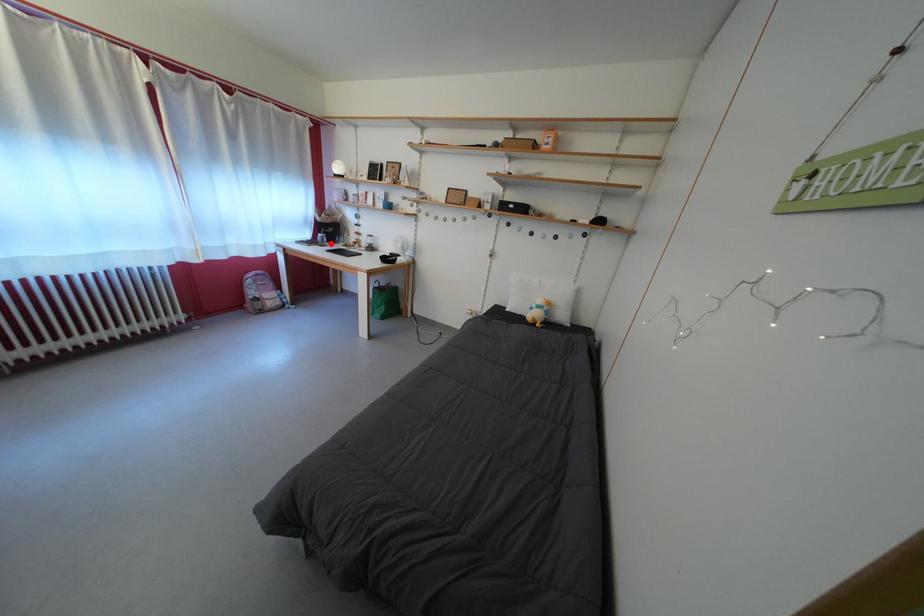
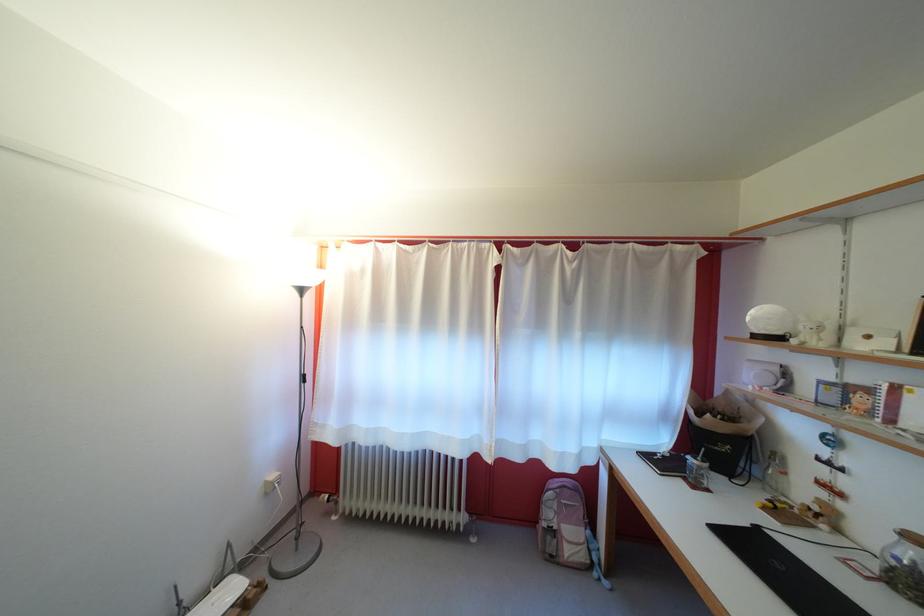
Question: I am providing you with two images of the same scene from different viewpoints. A red point is shown in image1. For the corresponding object point in image2, is it positioned nearer or farther from the camera?

Choices:
 (A) Nearer
 (B) Farther

Answer: (B)